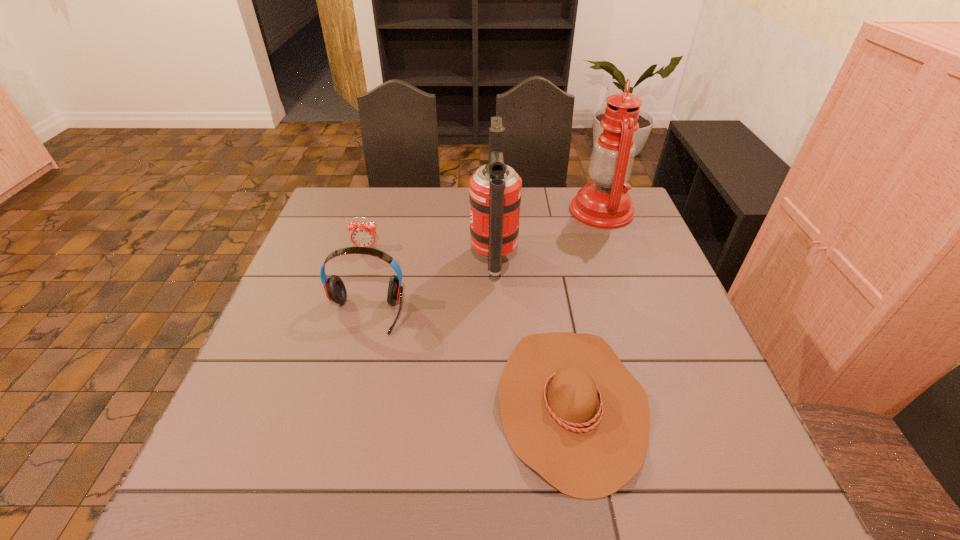
Find the location of `free point between the shortest object and the alarm clock`. free point between the shortest object and the alarm clock is located at coordinates (468, 326).

This screenshot has height=540, width=960. I want to click on free area in between the third shortest object and the cowboy hat, so click(x=468, y=358).

Identify which object is located as the second nearest to the fire extinguisher. Please provide its 2D coordinates. Your answer should be formatted as a tuple, i.e. [(x, y)], where the tuple contains the x and y coordinates of a point satisfying the conditions above.

[(334, 287)]

Locate an element on the screen. The image size is (960, 540). the fourth closest object relative to the cowboy hat is located at coordinates (363, 235).

Locate an element on the screen. This screenshot has width=960, height=540. vacant space that satisfies the following two spatial constraints: 1. on the back side of the shortest object; 2. on the front label side of the fire extinguisher is located at coordinates (546, 260).

The width and height of the screenshot is (960, 540). Identify the location of vacant region that satisfies the following two spatial constraints: 1. on the face of the shortest object; 2. on the right side of the fourth tallest object. (319, 403).

Where is `free space that satisfies the following two spatial constraints: 1. on the face of the second shortest object; 2. on the left side of the shortest object`? The height and width of the screenshot is (540, 960). free space that satisfies the following two spatial constraints: 1. on the face of the second shortest object; 2. on the left side of the shortest object is located at coordinates (319, 403).